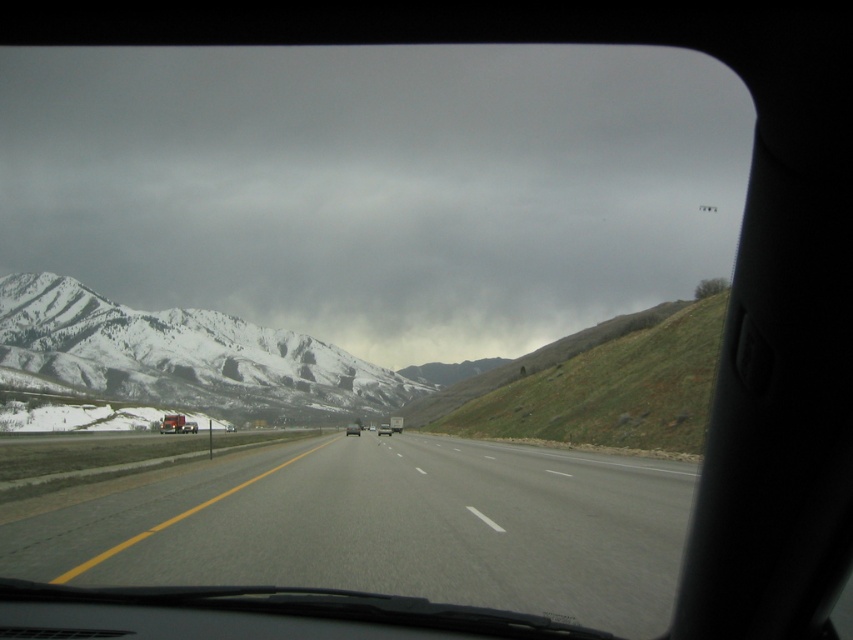
At what (x,y) coordinates should I click in order to perform the action: click on metallic silver truck at left. Please return your answer as a coordinate pair (x, y). This screenshot has width=853, height=640. Looking at the image, I should click on point(177,424).

Does metallic silver truck at left appear on the left side of silver metallic truck at center?

Correct, you'll find metallic silver truck at left to the left of silver metallic truck at center.

Is point (171, 422) closer to camera compared to point (346, 428)?

Yes, it is.

Image resolution: width=853 pixels, height=640 pixels. I want to click on metallic silver truck at left, so click(x=177, y=424).

Does point (16, 61) come farther from viewer compared to point (189, 394)?

Yes, it is.

Is gray cloudy sky at upper center in front of snowy rocky mountain at left?

No, gray cloudy sky at upper center is behind snowy rocky mountain at left.

Which is behind, point (518, 205) or point (239, 358)?

The point (518, 205) is behind.

Identify the location of gray cloudy sky at upper center. This screenshot has height=640, width=853. pos(376,186).

Is asphalt road at center smaller than metallic silver truck at left?

Actually, asphalt road at center might be larger than metallic silver truck at left.

Is asphalt road at center bigger than metallic silver truck at left?

Correct, asphalt road at center is larger in size than metallic silver truck at left.

Who is more distant from viewer, (631, 630) or (178, 419)?

The point (178, 419) is more distant.

Identify the location of asphalt road at center. The image size is (853, 640). (387, 528).